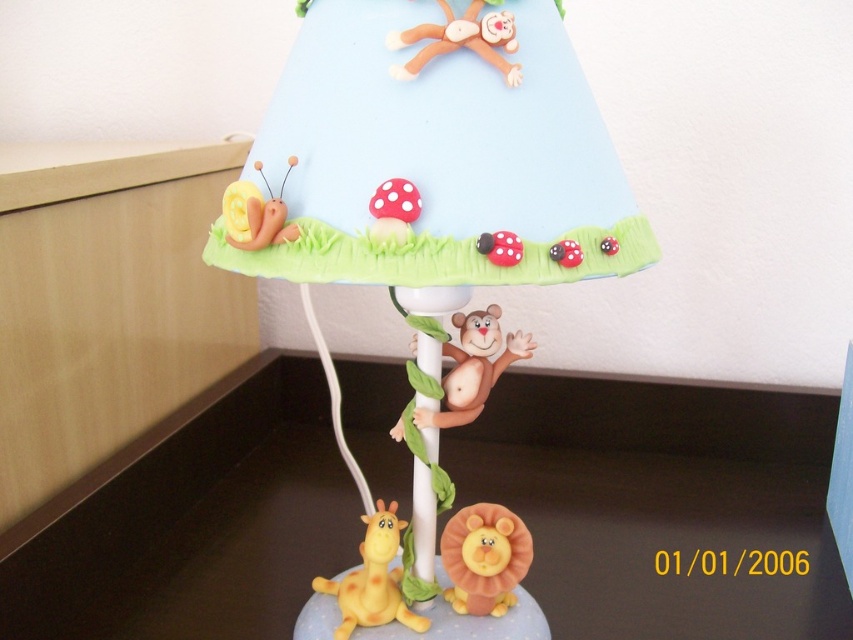
Question: Does matte plastic lampshade at upper center appear over matte plastic monkey at upper center?

Choices:
 (A) no
 (B) yes

Answer: (A)

Question: Is matte plastic lampshade at upper center closer to camera compared to matte plastic monkey at upper center?

Choices:
 (A) yes
 (B) no

Answer: (A)

Question: Which of the following is the farthest from the observer?

Choices:
 (A) matte plastic monkey at upper center
 (B) yellow matte giraffe at lower left

Answer: (B)

Question: Which of the following is the closest to the observer?

Choices:
 (A) matte plastic monkey at center
 (B) matte orange lion at lower center

Answer: (A)

Question: Is matte orange lion at lower center positioned behind yellow clay snail at upper left?

Choices:
 (A) yes
 (B) no

Answer: (A)

Question: Which of these objects is positioned farthest from the matte plastic lampshade at upper center?

Choices:
 (A) yellow clay snail at upper left
 (B) yellow matte giraffe at lower left
 (C) matte white table at lower center

Answer: (C)